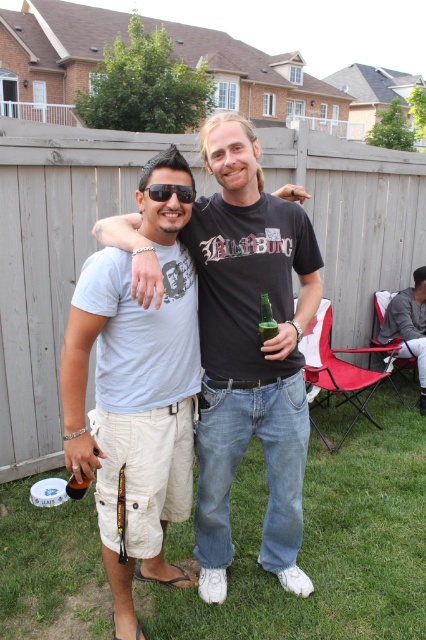
Question: Is wooden fence at center thinner than gray cotton jacket at lower right?

Choices:
 (A) no
 (B) yes

Answer: (A)

Question: Which point is closer to the camera?

Choices:
 (A) click(72, 230)
 (B) click(127, 605)
 (C) click(261, 316)
 (D) click(276, 438)

Answer: (C)

Question: Can you confirm if light beige cargo shorts at center is smaller than black matte sunglasses at center?

Choices:
 (A) yes
 (B) no

Answer: (B)

Question: Which point is closer to the camera?

Choices:
 (A) (267, 317)
 (B) (43, 211)

Answer: (A)

Question: Which object is positioned closest to the brown matte bottle at lower left?

Choices:
 (A) light beige cargo shorts at center
 (B) wooden fence at center

Answer: (A)

Question: Is black matte sunglasses at center above brown matte bottle at lower left?

Choices:
 (A) no
 (B) yes

Answer: (B)